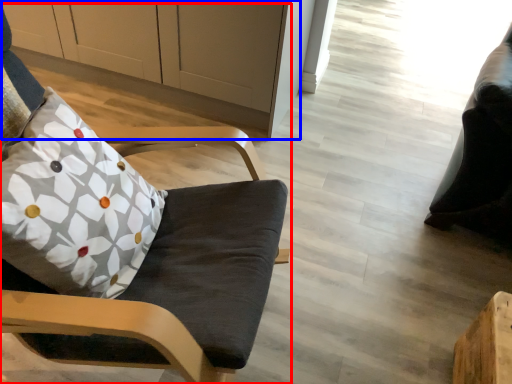
Question: Which point is further to the camera, chair (highlighted by a red box) or cabinetry (highlighted by a blue box)?

Choices:
 (A) chair
 (B) cabinetry

Answer: (B)